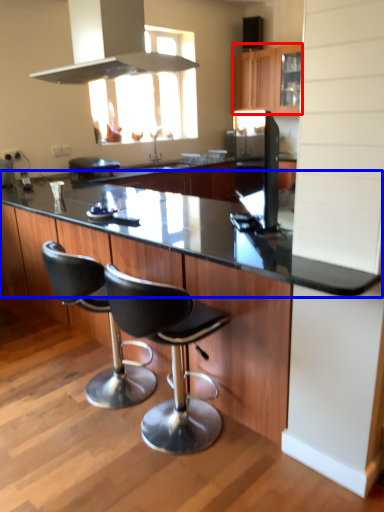
Question: Among these objects, which one is nearest to the camera, cabinetry (highlighted by a red box) or countertop (highlighted by a blue box)?

Choices:
 (A) cabinetry
 (B) countertop

Answer: (B)